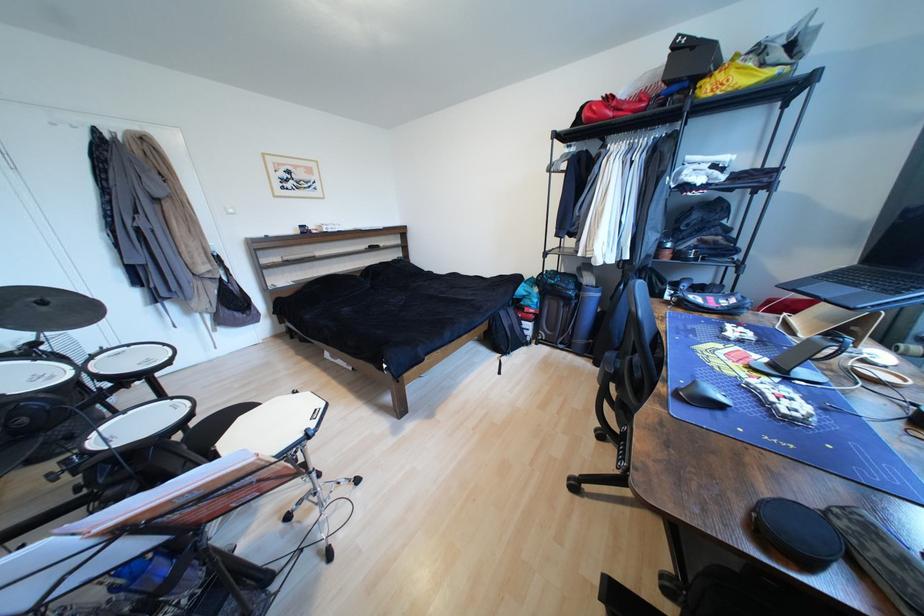
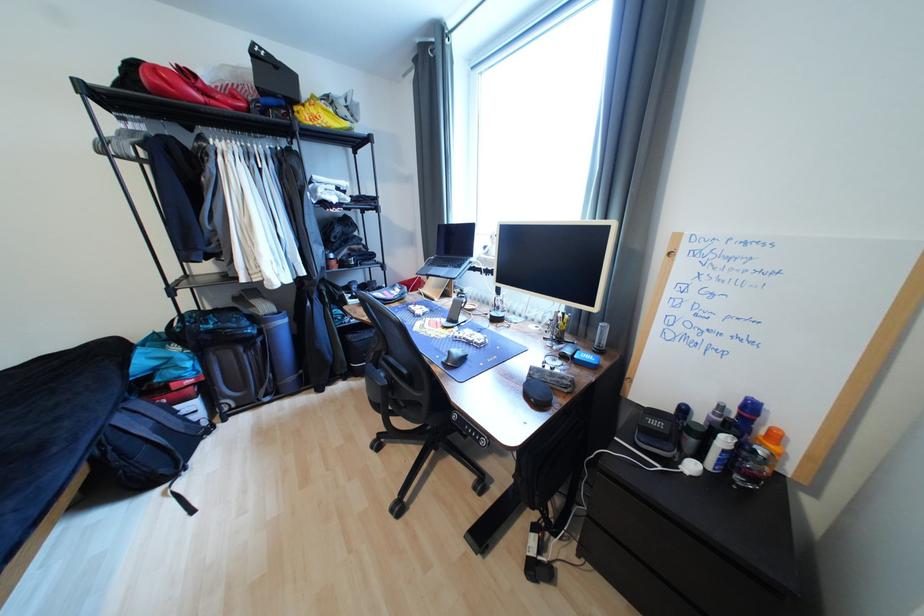
Question: How did the camera likely rotate?

Choices:
 (A) Left
 (B) Right
 (C) Up
 (D) Down

Answer: (B)